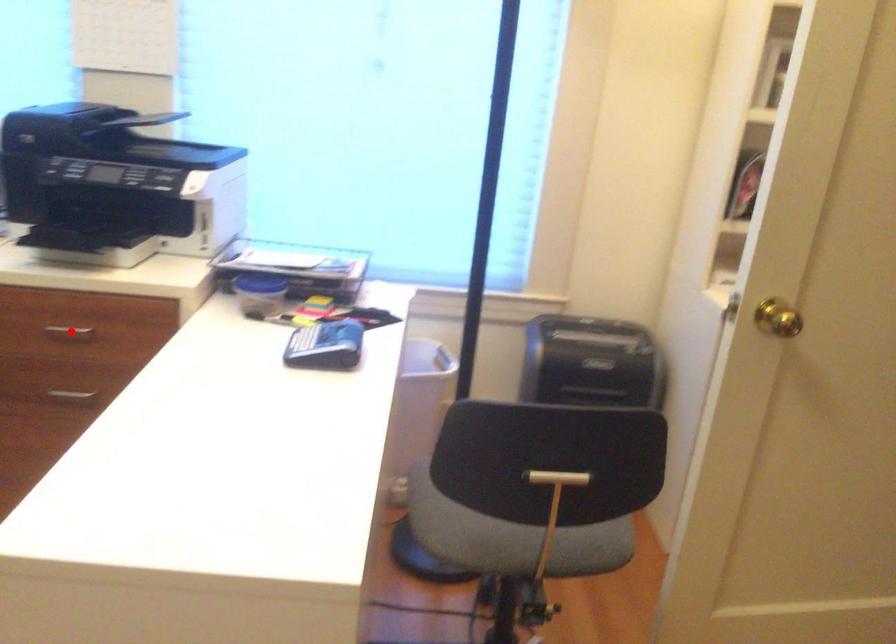
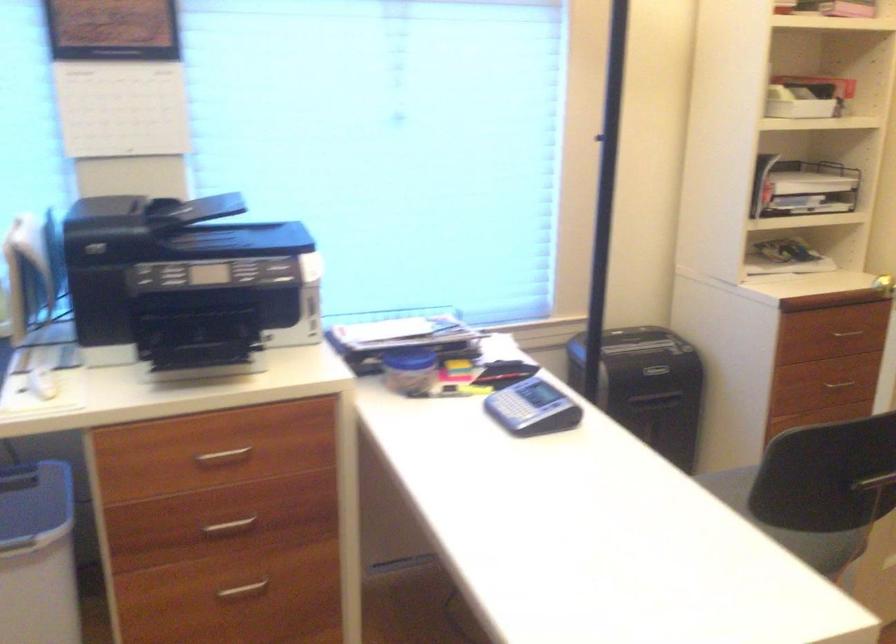
Question: A red point is marked in image1. In image2, is the corresponding 3D point closer to the camera or farther? Reply with the corresponding letter.

Choices:
 (A) The corresponding 3D point is closer.
 (B) The corresponding 3D point is farther.

Answer: (A)